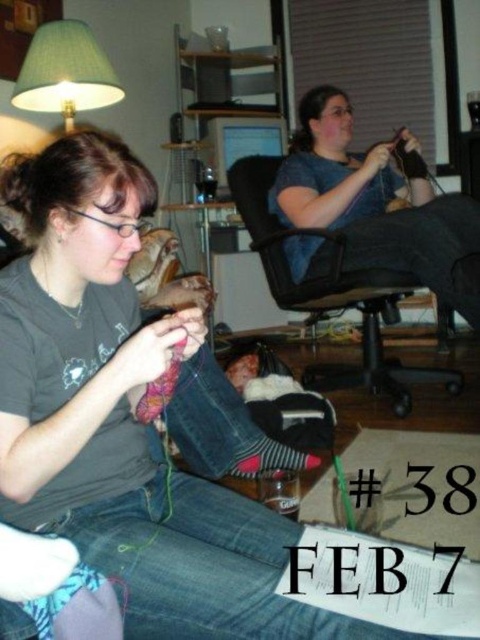
You are planning to place a small decorative item exactly at the center of the image. Considering the denim at left and the person knitting with vibrant pink yarn, which object is closer to the center?

The denim at left is located at point (202, 564), which is closer to the center of the image compared to the person knitting with vibrant pink yarn.

From the picture: You are a delivery person who needs to place a small package between the denim at left and the green fabric lampshade at upper left. Which object should you move to make space?

The denim at left might be wider than the green fabric lampshade at upper left, so you should move the denim at left to make space for the package.